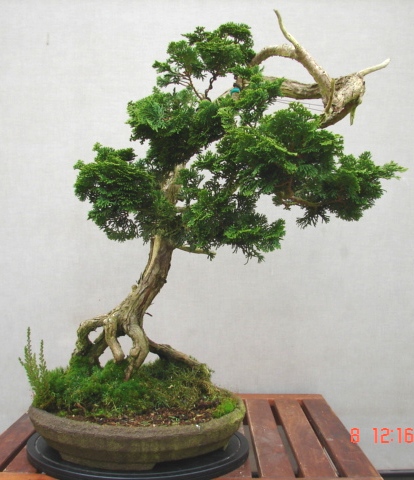
Identify the location of table. (266, 446).